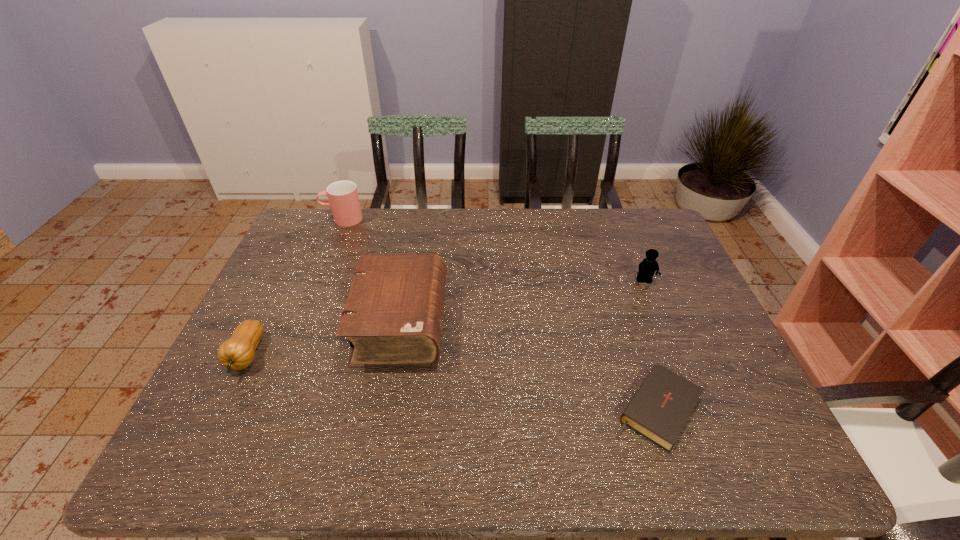
Locate an element on the screen. This screenshot has width=960, height=540. free space located on the back of the shortest object is located at coordinates (610, 268).

Identify the location of object present at the far edge. (344, 203).

In order to click on object located in the near edge section of the desktop in this screenshot , I will do `click(659, 410)`.

The height and width of the screenshot is (540, 960). Find the location of `cup that is at the left edge`. cup that is at the left edge is located at coordinates (344, 203).

In order to click on gourd located at the left edge in this screenshot , I will do `click(238, 352)`.

Locate an element on the screen. Lego that is at the right edge is located at coordinates (647, 268).

Locate an element on the screen. Bible that is at the right edge is located at coordinates (x=659, y=410).

Identify the location of object at the far left corner. [344, 203].

Where is `object present at the near right corner`? object present at the near right corner is located at coordinates (659, 410).

Identify the location of vacant space at the far edge of the desktop. This screenshot has height=540, width=960. (420, 213).